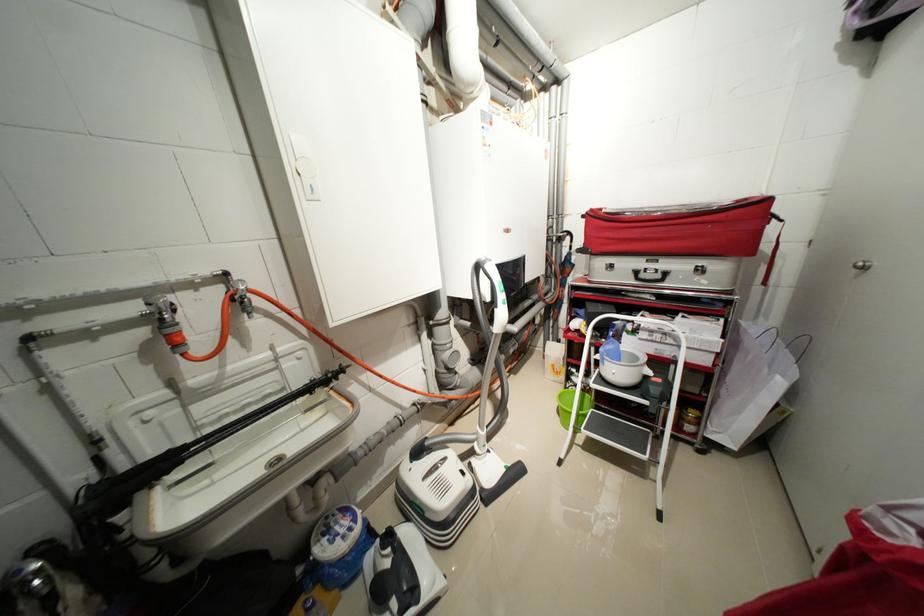
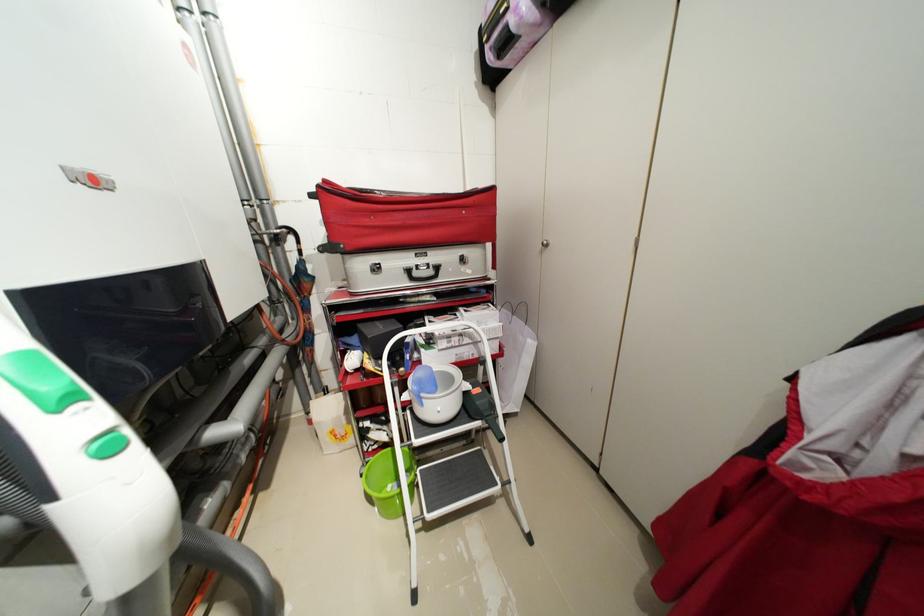
Locate, in the second image, the point that corresponds to point 611,360 in the first image.

(428, 400)